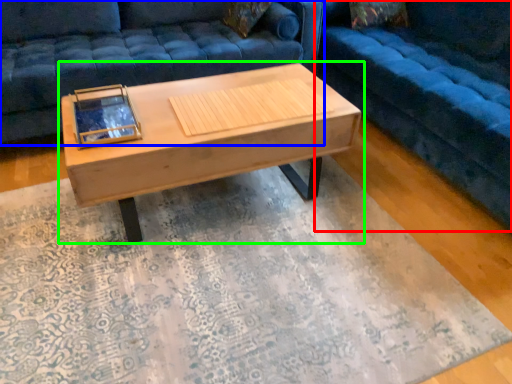
Question: Estimate the real-world distances between objects in this image. Which object is farther from studio couch (highlighted by a red box), studio couch (highlighted by a blue box) or coffee table (highlighted by a green box)?

Choices:
 (A) studio couch
 (B) coffee table

Answer: (A)